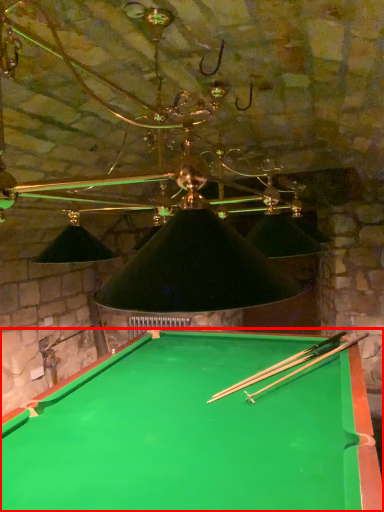
Question: From the image's perspective, where is billiard table (annotated by the red box) located relative to cue?

Choices:
 (A) above
 (B) below

Answer: (B)